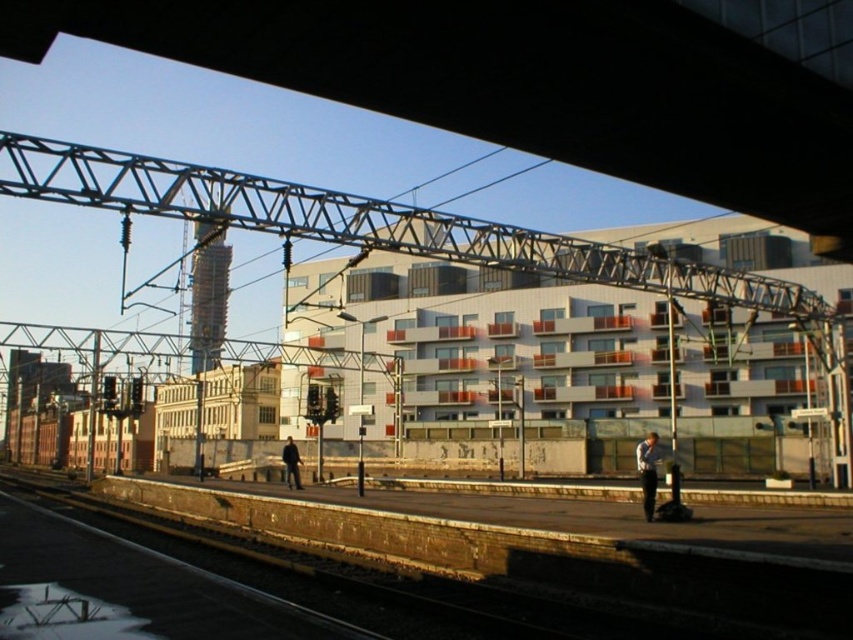
Does light blue shirt at lower right have a greater width compared to dark blue jeans at center?

Result: Yes.

Does point (654, 458) lie in front of point (299, 472)?

Yes, it is.

Locate an element on the screen. light blue shirt at lower right is located at coordinates (647, 472).